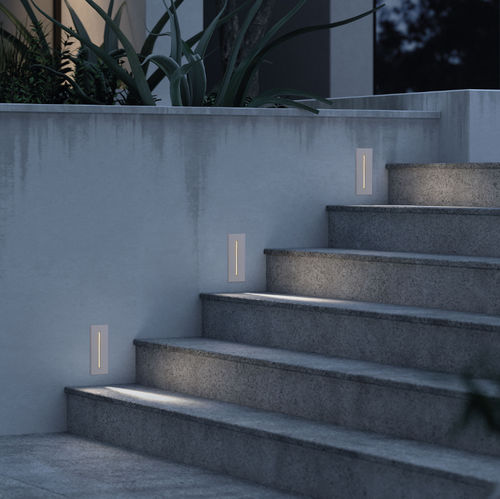
Where is `top of stairs`? The image size is (500, 499). top of stairs is located at coordinates (306, 432), (353, 367), (381, 308), (402, 251).